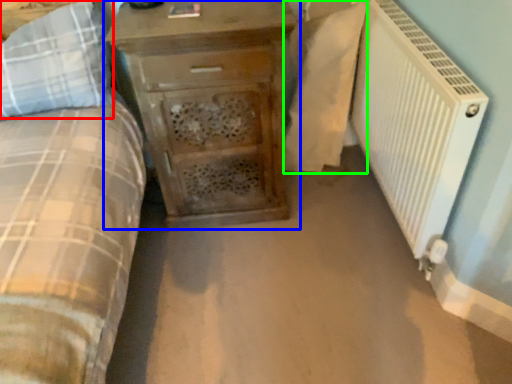
Question: Which object is the farthest from pillow (highlighted by a red box)? Choose among these: chest of drawers (highlighted by a blue box) or sheet (highlighted by a green box).

Choices:
 (A) chest of drawers
 (B) sheet

Answer: (B)